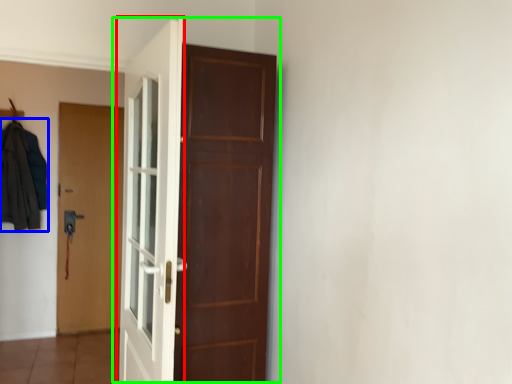
Question: Based on their relative distances, which object is farther from door (highlighted by a red box)? Choose from clothing (highlighted by a blue box) and door (highlighted by a green box).

Choices:
 (A) clothing
 (B) door

Answer: (A)